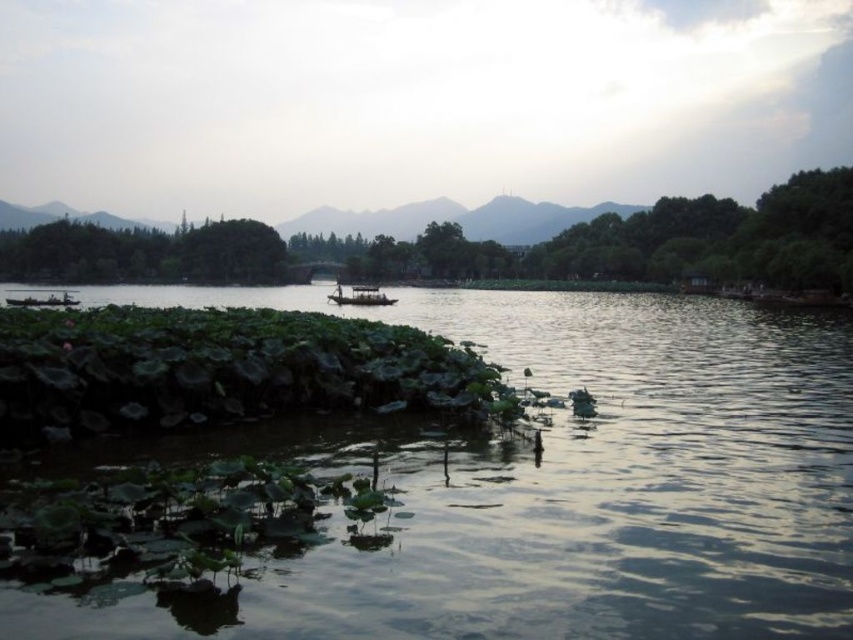
You are standing on the lakeshore and want to cross to the opposite side. The wooden boat at center is available for use. Considering the green leafy river at center, will the boat fit comfortably in the river without touching the banks?

The green leafy river at center is wider than the wooden boat at center, so the boat will fit comfortably without touching the banks.

You are standing at the lakeside and want to place a small decorative rock between the two points labeled point (614,301) and point (378,300). Which point is closer to you so you can start placing the rock from there?

Point (614,301) is closer to you than point (378,300), so you should start placing the rock from point (614,301).